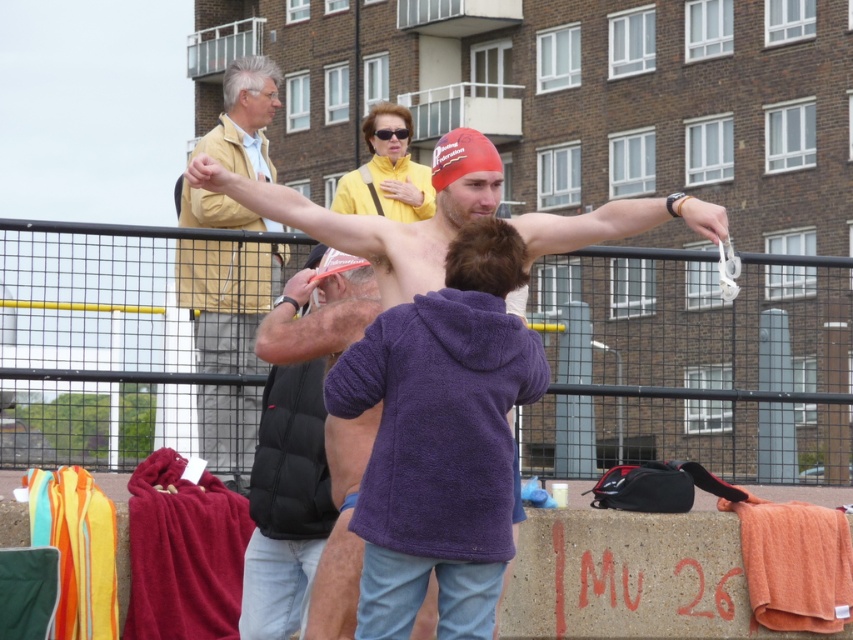
Does black mesh fence at lower center appear over light yellow jacket at upper left?

No.

Looking at this image, is black mesh fence at lower center smaller than light yellow jacket at upper left?

No, black mesh fence at lower center is not smaller than light yellow jacket at upper left.

Is point (618, 456) more distant than point (260, 250)?

Yes, point (618, 456) is behind point (260, 250).

Locate an element on the screen. Image resolution: width=853 pixels, height=640 pixels. black mesh fence at lower center is located at coordinates (693, 364).

In the scene shown: Is black mesh fence at lower center positioned behind shiny red swim cap at center?

Yes, black mesh fence at lower center is further from the viewer.

Is black mesh fence at lower center to the left of shiny red swim cap at center from the viewer's perspective?

Yes, black mesh fence at lower center is to the left of shiny red swim cap at center.

The image size is (853, 640). Describe the element at coordinates (693, 364) in the screenshot. I see `black mesh fence at lower center` at that location.

What are the coordinates of `black mesh fence at lower center` in the screenshot? It's located at pos(693,364).

Does black mesh fence at lower center have a smaller size compared to black puffer vest at center?

No, black mesh fence at lower center is not smaller than black puffer vest at center.

Who is lower down, black mesh fence at lower center or black puffer vest at center?

Positioned lower is black puffer vest at center.

In the scene shown: Who is more forward, (793, 470) or (305, 502)?

Positioned in front is point (305, 502).

Where is `black mesh fence at lower center`? black mesh fence at lower center is located at coordinates (693, 364).